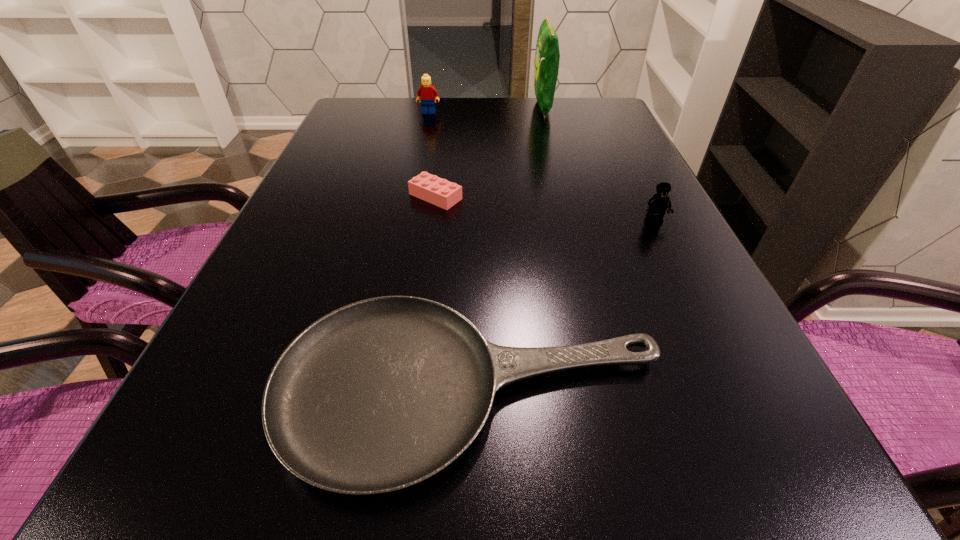
What are the coordinates of `free point between the shortest object and the farthest Lego` in the screenshot? It's located at (449, 251).

Identify the location of free space between the third tallest object and the tallest object. (598, 164).

Identify the location of blank region between the fourth shortest object and the crisp (potato chip). This screenshot has width=960, height=540. (486, 110).

Identify the location of vacant point located between the second farthest Lego and the tallest object. (490, 152).

Find the location of `free space between the third shortest object and the tallest object`. free space between the third shortest object and the tallest object is located at coordinates (598, 164).

Find the location of a particular element. free space between the tallest object and the frying pan is located at coordinates (507, 248).

At what (x,y) coordinates should I click in order to perform the action: click on free area in between the crisp (potato chip) and the rightmost Lego. Please return your answer as a coordinate pair (x, y). The height and width of the screenshot is (540, 960). Looking at the image, I should click on coord(598,164).

In order to click on free space between the second nearest Lego and the second tallest Lego in this screenshot , I will do `click(544, 209)`.

Where is `free space between the tallest object and the farthest Lego`? The height and width of the screenshot is (540, 960). free space between the tallest object and the farthest Lego is located at coordinates (486, 110).

Locate an element on the screen. Image resolution: width=960 pixels, height=540 pixels. empty space between the second nearest object and the nearest object is located at coordinates (563, 305).